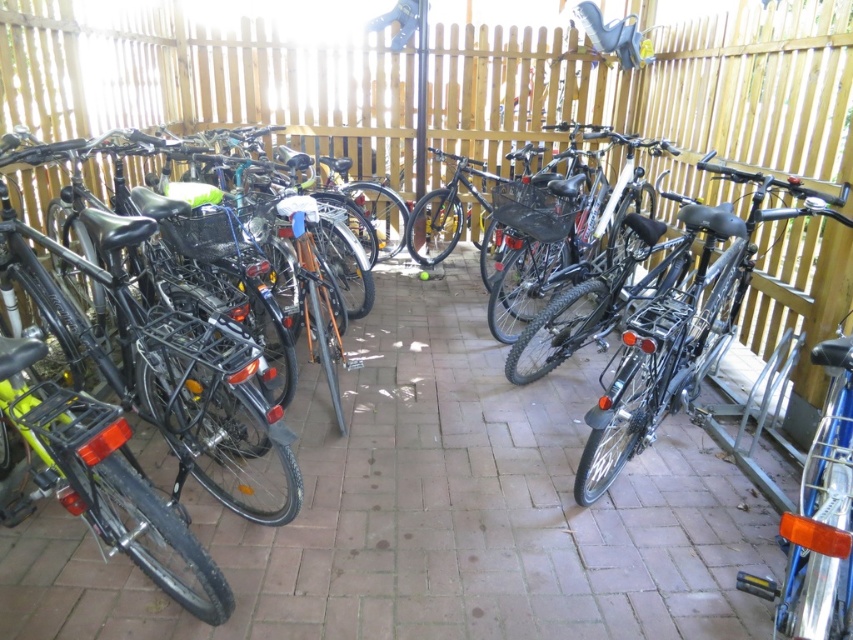
Question: Is matte black bicycle at left closer to the viewer compared to shiny silver bicycle at right?

Choices:
 (A) yes
 (B) no

Answer: (B)

Question: Is shiny black bicycle at right thinner than shiny silver bicycle at right?

Choices:
 (A) no
 (B) yes

Answer: (A)

Question: Which object is closer to the camera taking this photo?

Choices:
 (A) matte black bicycle at left
 (B) shiny silver bicycle at right
 (C) shiny black bicycle at right

Answer: (B)

Question: Can you confirm if shiny black bicycle at right is positioned above shiny silver bicycle at right?

Choices:
 (A) no
 (B) yes

Answer: (B)

Question: Which is nearer to the matte black bicycle at left?

Choices:
 (A) shiny black bicycle at right
 (B) shiny silver bicycle at right

Answer: (A)

Question: Which object is farther from the camera taking this photo?

Choices:
 (A) matte black bicycle at left
 (B) shiny silver bicycle at right
 (C) shiny black bicycle at right

Answer: (C)